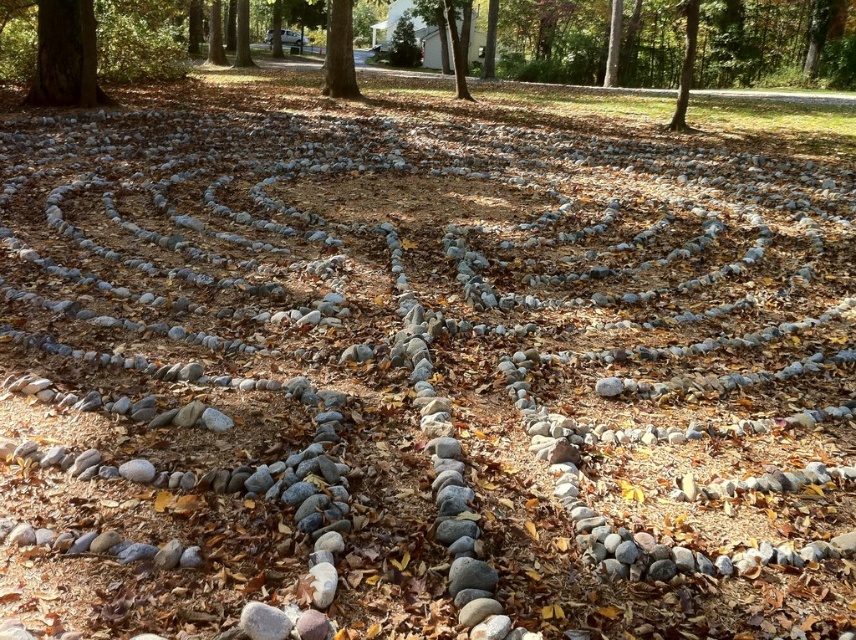
You are a surveyor measuring the distance between two trees in the labyrinth scene. The smooth bark tree at upper center and the green textured tree at upper right are both visible from your current position. Can a 10 meter measuring tape reach both trees without needing to move its starting point?

The distance between the smooth bark tree at upper center and the green textured tree at upper right is 11.36 meters. Since the measuring tape is only 10 meters long, it cannot fully reach both trees without moving the starting point.

You are standing at the entrance of the stone labyrinth and want to determine which tree is taller. You see the green textured tree at upper right and the green leafy tree at upper center. Which tree is taller?

The green textured tree at upper right is taller than the green leafy tree at upper center according to the description.

You are standing at the entrance of the stone labyrinth and want to find the smooth bark tree at upper center. According to the coordinates provided, where should you look relative to your position?

The smooth bark tree at upper center is located at point coordinates (339, 51), which means it is positioned to the upper center relative to your current position at the labyrinth entrance.